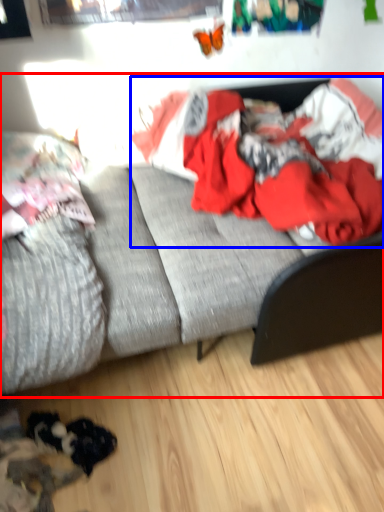
Question: Which of the following is the closest to the observer, studio couch (highlighted by a red box) or clothing (highlighted by a blue box)?

Choices:
 (A) studio couch
 (B) clothing

Answer: (A)